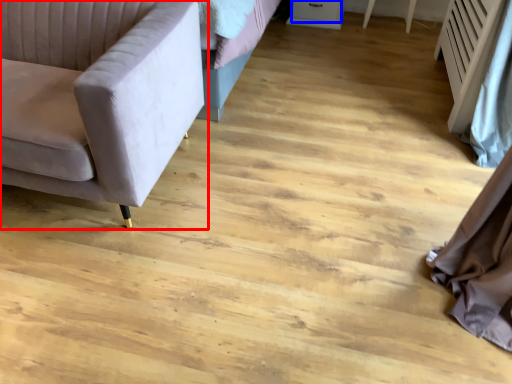
Question: Among these objects, which one is nearest to the camera, studio couch (highlighted by a red box) or drawer (highlighted by a blue box)?

Choices:
 (A) studio couch
 (B) drawer

Answer: (A)